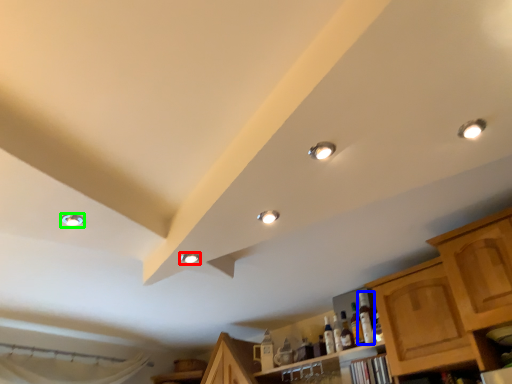
Question: Which object is the farthest from droplight (highlighted by a red box)? Choose among these: bottle (highlighted by a blue box) or droplight (highlighted by a green box).

Choices:
 (A) bottle
 (B) droplight

Answer: (A)